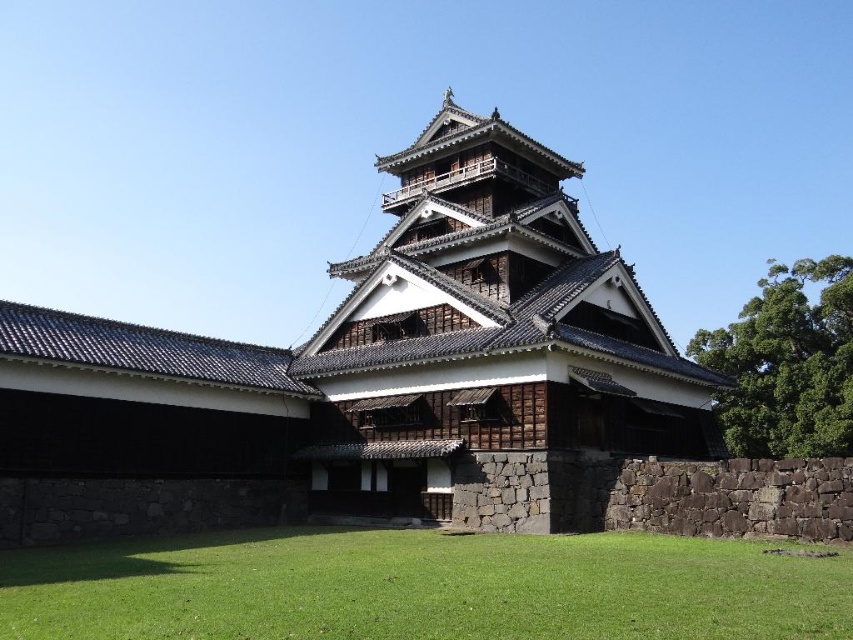
How much distance is there between dark brown wood at center and green grass at lower center?

dark brown wood at center and green grass at lower center are 15.02 meters apart.

Can you confirm if dark brown wood at center is smaller than green grass at lower center?

No.

Between point (466, 257) and point (215, 604), which one is positioned behind?

The point (466, 257) is behind.

Find the location of a particular element. The width and height of the screenshot is (853, 640). dark brown wood at center is located at coordinates (366, 372).